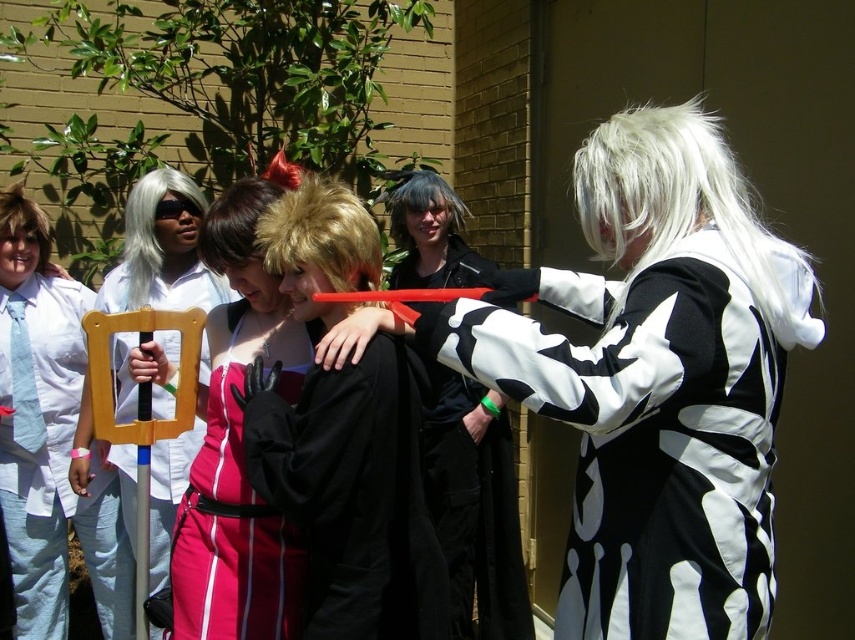
You are a photographer trying to capture a candid shot of the black matte robe at center and the shiny brown wig at center. Since you want to ensure both are in focus, you need to know which object is taller. Which one is taller?

The black matte robe at center is taller than the shiny brown wig at center according to the description.

You are taking a photo of two points in the scene. The first point is at coordinates point (118, 406) and the second is at point (10, 186). Which point will appear larger in your photo?

Point (118, 406) is closer to the camera than point (10, 186), so it will appear larger in the photo.